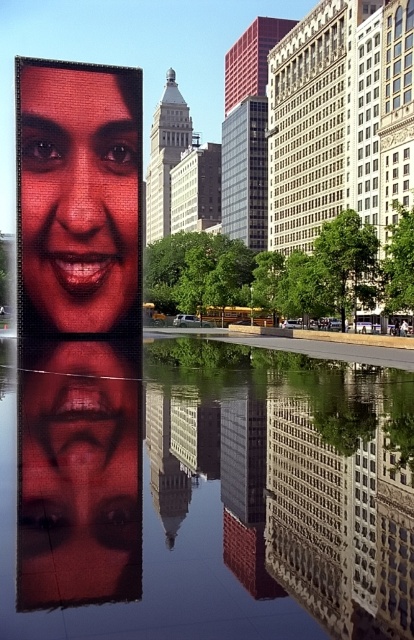
You are standing in the urban scene and want to determine which of the two points, point (19, 531) or point (108, 480), is nearer to you. Based on the spatial arrangement, which point is closer?

Point (19, 531) is closer to the viewer than point (108, 480).

You are an architect observing the urban scene and need to determine the order of the matte red face at upper left and the matte black face at center from your perspective. Which one appears closer to you?

The matte red face at upper left appears closer to you because it is further to the viewer than the matte black face at center.